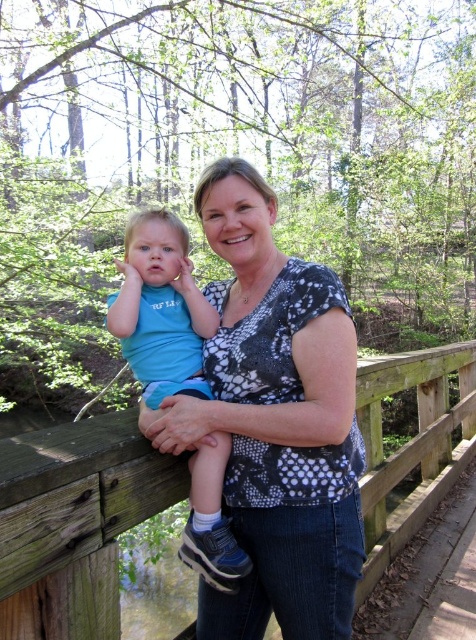
You are standing on the wooden bridge at center and want to hand a small toy to the person wearing the patterned fabric shirt at center. Can you reach them without moving from your current position?

The patterned fabric shirt at center is 8.45 feet away from the wooden bridge at center. Since the distance is greater than an average person can reach, you cannot hand the toy without moving.

You are a photographer trying to capture a closeup shot of both the patterned fabric shirt at center and the matte blue shirt at left. Given that your camera can only focus on objects within a 20 centimeter range, will you be able to capture both shirts in focus?

The patterned fabric shirt at center and the matte blue shirt at left are 21.73 centimeters apart from each other. Since the distance between them exceeds the camera focus range of 20 centimeters, you will not be able to capture both shirts in focus simultaneously.

From the picture: You are standing in front of the wooden bridge and want to hand a small toy to the person wearing the patterned fabric shirt at center. Can you reach them without moving closer? The toy is 1 foot long.

The patterned fabric shirt at center is 5.21 feet away from the viewer. Since the toy is 1 foot long, you cannot reach them without moving closer as the distance is greater than the toy length.